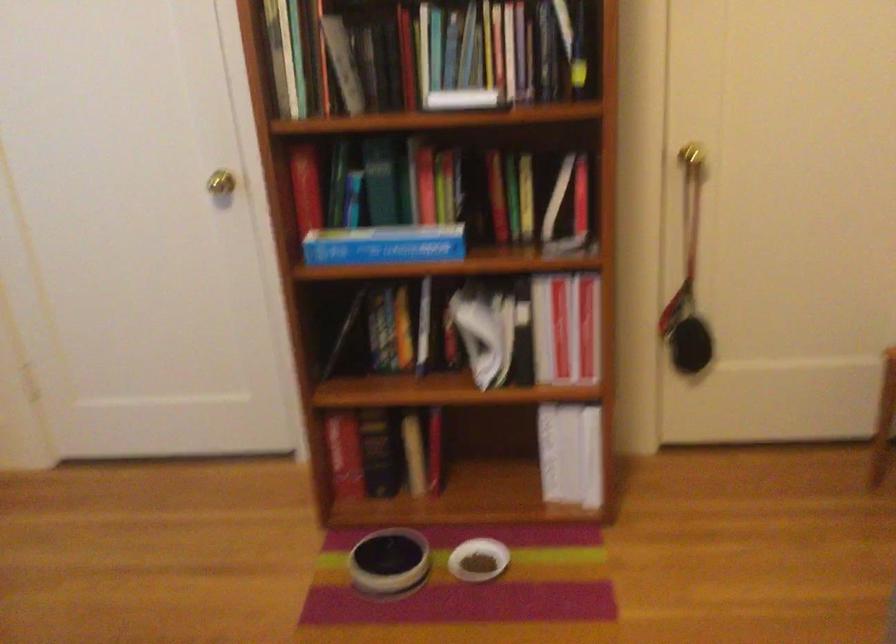
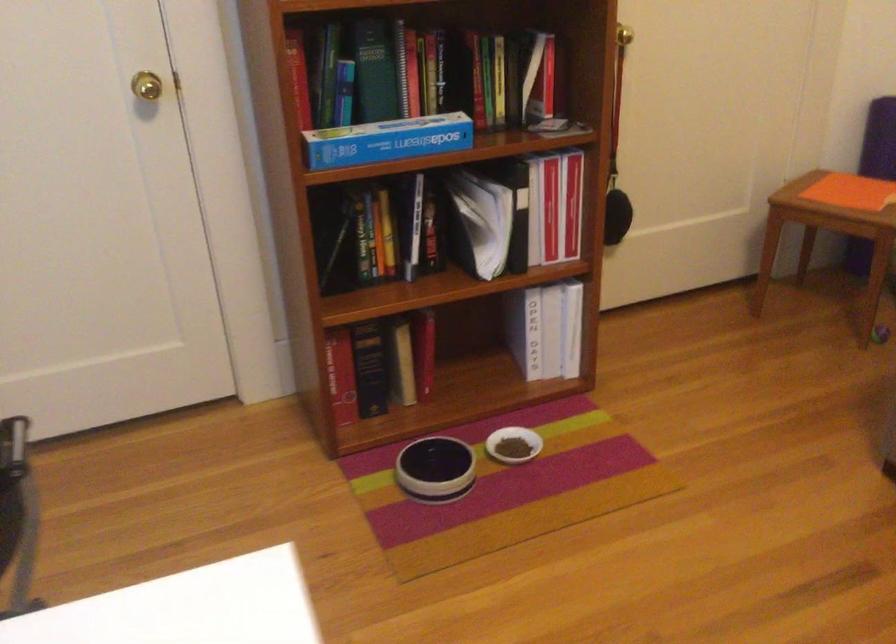
Find the pixel in the second image that matches (709,149) in the first image.

(624, 35)